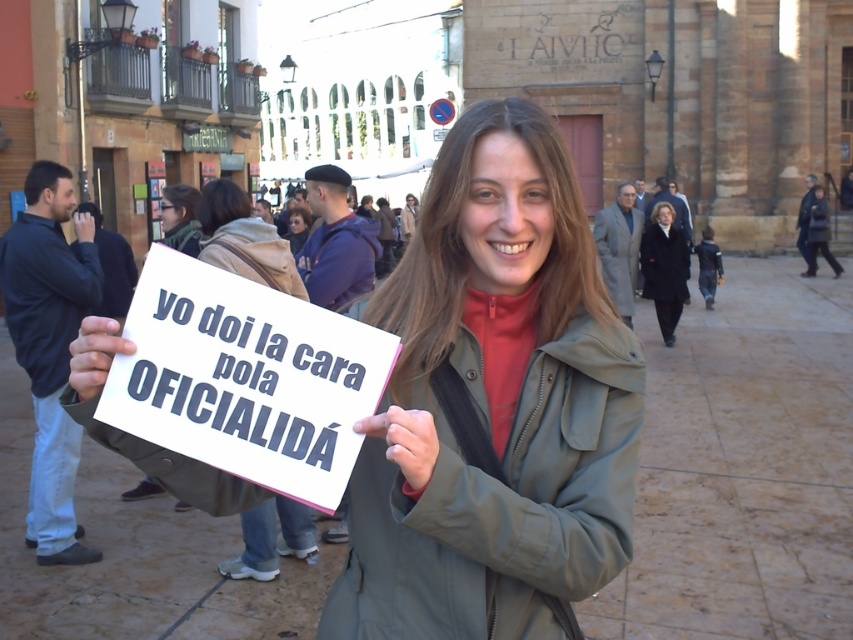
You are a photographer trying to capture a detailed shot of the dark blue coat at upper right and the dark brown hair at center. Based on their sizes in the image, which object would require you to move closer to the subject to get a clear photo?

The dark blue coat at upper right has a smaller size compared to the dark brown hair at center, so you would need to move closer to the dark blue coat at upper right to capture it in detail.